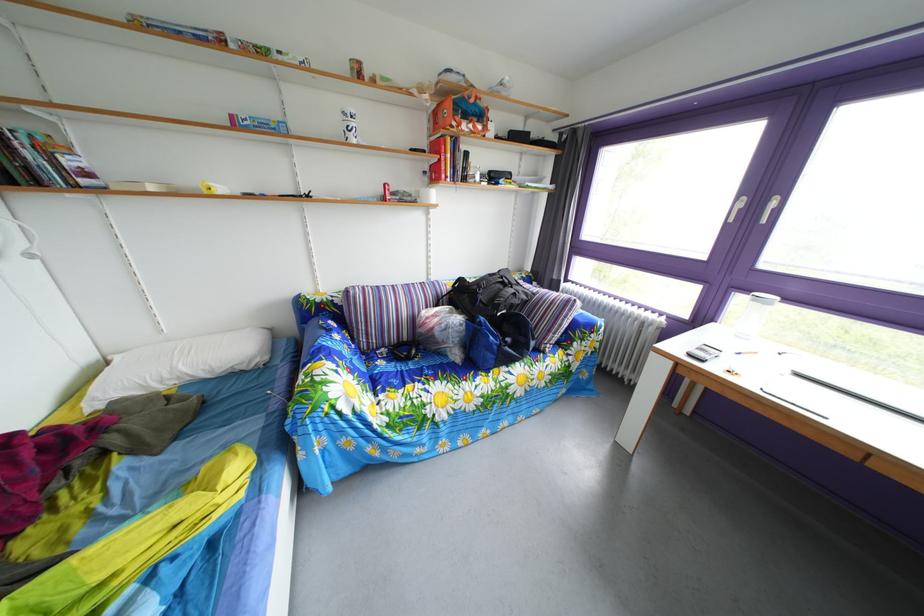
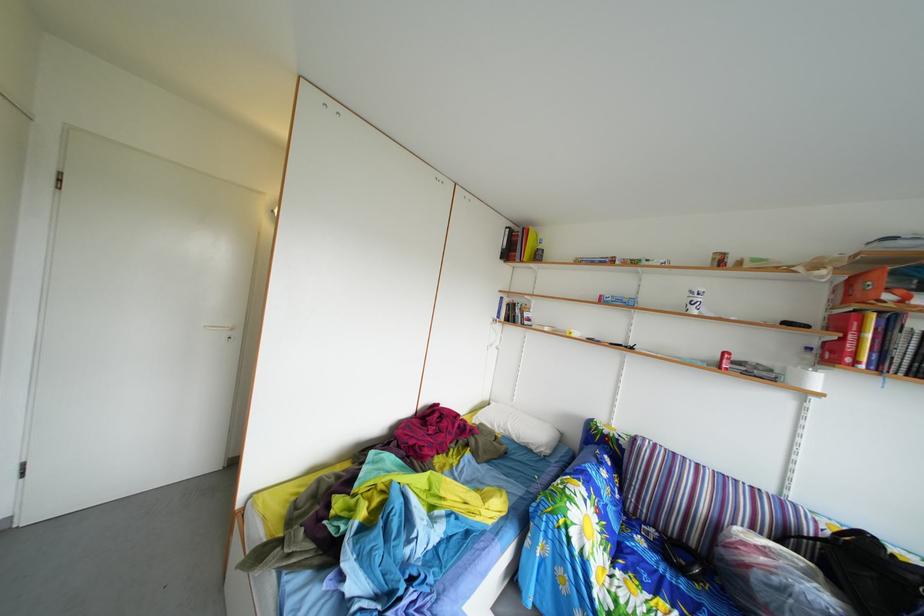
Question: Based on the continuous images, in which direction is the camera rotating? Reply with the corresponding letter.

Choices:
 (A) Left
 (B) Right
 (C) Up
 (D) Down

Answer: (A)